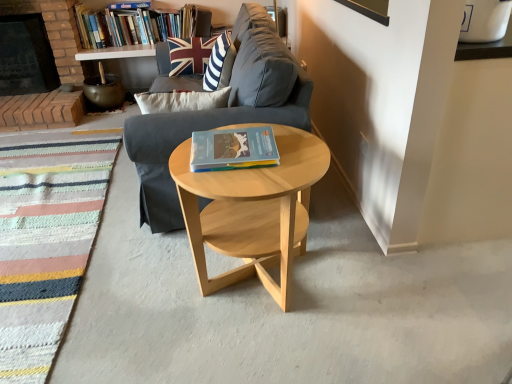
Identify the location of vacant area in front of hardcover book at center, which is counted as the second book, starting from the top. The height and width of the screenshot is (384, 512). (230, 185).